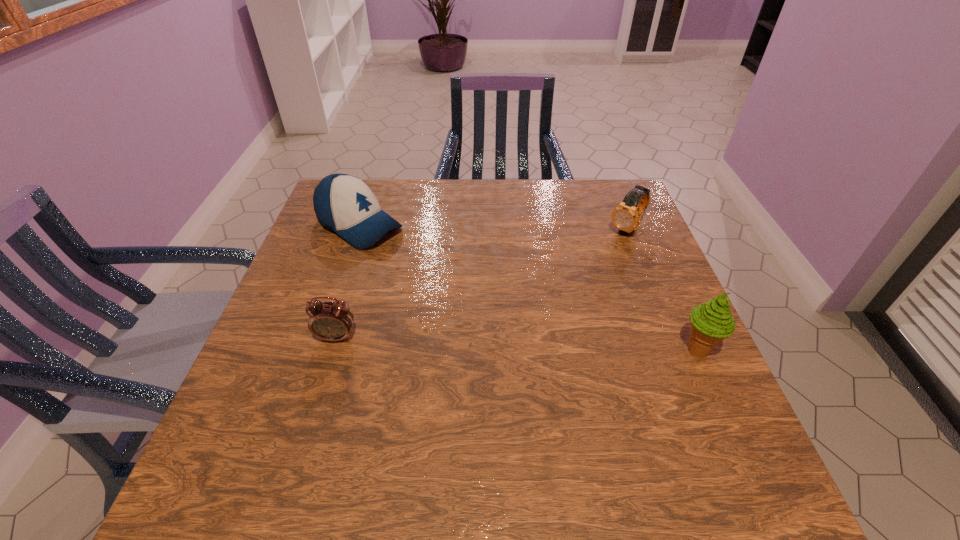
This screenshot has width=960, height=540. What are the coordinates of `free space on the desktop that is between the alarm clock and the icecream and is positioned on the front-facing side of the baseball cap` in the screenshot? It's located at [565, 346].

Locate an element on the screen. This screenshot has width=960, height=540. free space on the desktop that is between the alarm clock and the icecream and is positioned on the face of the watch is located at coordinates (514, 344).